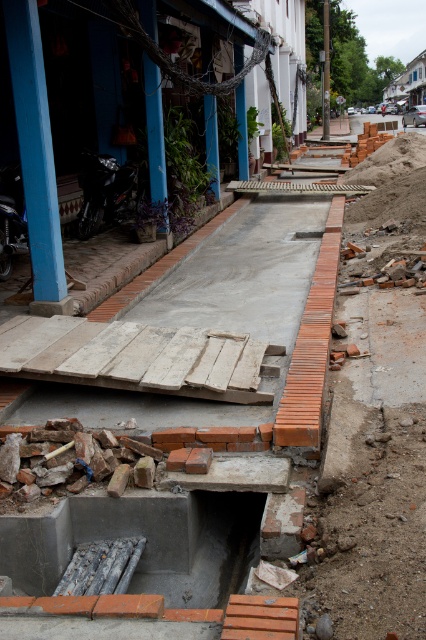
You are a delivery person trying to navigate through the construction site to reach the store entrance. You see the blue painted wood at left and the blue painted wood at upper left. Which one is positioned more to the left side?

The blue painted wood at left is positioned more to the left side than the blue painted wood at upper left.

From the picture: You are a construction worker who needs to choose between two blue painted wood pieces for reinforcing the unstable curb. The blue painted wood at left and the blue painted wood at upper left are available. Which one should you pick for better support?

The blue painted wood at left is larger in size than the blue painted wood at upper left, so you should pick the blue painted wood at left for better support.